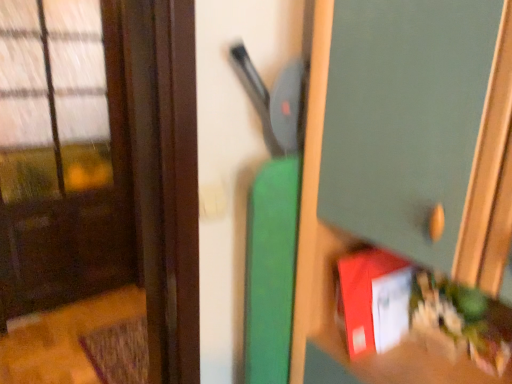
Locate an element on the screen. The width and height of the screenshot is (512, 384). matte red book at lower right, the 2th book positioned from the right is located at coordinates (374, 300).

Describe the element at coordinates (405, 164) in the screenshot. I see `green matte cabinet at center` at that location.

In order to face red matte book at lower right, which is counted as the first book, starting from the right, should I rotate leftwards or rightwards?

Rotate your view right by about 24.492°.

What do you see at coordinates (98, 189) in the screenshot?
I see `brown matte door at left` at bounding box center [98, 189].

Find the location of a particular element. matte red book at lower right, the 1th book positioned from the left is located at coordinates (374, 300).

How different are the orientations of brown matte door at left and red matte book at lower right, which is counted as the first book, starting from the right, in degrees?

The facing directions of brown matte door at left and red matte book at lower right, which is counted as the first book, starting from the right, are 88 degrees apart.

Which object is positioned more to the right, brown matte door at left or red matte book at lower right, which is counted as the first book, starting from the right?

From the viewer's perspective, red matte book at lower right, which is counted as the first book, starting from the right, appears more on the right side.

Considering the relative sizes of brown matte door at left and red matte book at lower right, which is counted as the 2th book, starting from the left, in the image provided, is brown matte door at left bigger than red matte book at lower right, which is counted as the 2th book, starting from the left,?

Correct, brown matte door at left is larger in size than red matte book at lower right, which is counted as the 2th book, starting from the left.

Which object is closer to the camera taking this photo, brown matte door at left or red matte book at lower right, which is counted as the 2th book, starting from the left?

red matte book at lower right, which is counted as the 2th book, starting from the left, is in front.

Does brown matte door at left have a greater width compared to green matte cabinet at center?

No, brown matte door at left is not wider than green matte cabinet at center.

From the image's perspective, is brown matte door at left over green matte cabinet at center?

Yes, from the image's perspective, brown matte door at left is on top of green matte cabinet at center.

In terms of height, does brown matte door at left look taller or shorter compared to green matte cabinet at center?

Clearly, brown matte door at left is taller compared to green matte cabinet at center.

Is brown matte door at left behind green matte cabinet at center?

Yes, brown matte door at left is behind green matte cabinet at center.

Measure the distance from red matte book at lower right, which is counted as the first book, starting from the right, to green matte cabinet at center.

red matte book at lower right, which is counted as the first book, starting from the right, and green matte cabinet at center are 7.42 inches apart from each other.

Is point (510, 380) positioned in front of point (434, 21)?

No.

Does red matte book at lower right, which is counted as the first book, starting from the right, come in front of green matte cabinet at center?

No, red matte book at lower right, which is counted as the first book, starting from the right, is behind green matte cabinet at center.

Is matte red book at lower right, the 2th book positioned from the right, located outside red matte book at lower right, which is counted as the first book, starting from the right?

matte red book at lower right, the 2th book positioned from the right, lies outside red matte book at lower right, which is counted as the first book, starting from the right,'s area.

Measure the distance between matte red book at lower right, the 1th book positioned from the left, and red matte book at lower right, which is counted as the first book, starting from the right.

matte red book at lower right, the 1th book positioned from the left, is 1.62 inches away from red matte book at lower right, which is counted as the first book, starting from the right.

From a real-world perspective, is matte red book at lower right, the 1th book positioned from the left, positioned under red matte book at lower right, which is counted as the 2th book, starting from the left, based on gravity?

No, from a real-world perspective, matte red book at lower right, the 1th book positioned from the left, is not below red matte book at lower right, which is counted as the 2th book, starting from the left.

Which object is closer to the camera taking this photo, matte red book at lower right, the 2th book positioned from the right, or red matte book at lower right, which is counted as the first book, starting from the right?

red matte book at lower right, which is counted as the first book, starting from the right, is closer to the camera.

Considering their positions, is matte red book at lower right, the 1th book positioned from the left, located in front of or behind green matte cabinet at center?

matte red book at lower right, the 1th book positioned from the left, is positioned farther from the viewer than green matte cabinet at center.

In the image, is matte red book at lower right, the 1th book positioned from the left, on the left side or the right side of green matte cabinet at center?

matte red book at lower right, the 1th book positioned from the left, is positioned on green matte cabinet at center's left side.

From the image's perspective, is matte red book at lower right, the 2th book positioned from the right, below green matte cabinet at center?

Yes, from the image's perspective, matte red book at lower right, the 2th book positioned from the right, is beneath green matte cabinet at center.

What's the angular difference between brown matte door at left and matte red book at lower right, the 1th book positioned from the left,'s facing directions?

6.19 degrees.

Can you see brown matte door at left touching matte red book at lower right, the 1th book positioned from the left?

brown matte door at left and matte red book at lower right, the 1th book positioned from the left, are not in contact.

From the image's perspective, is brown matte door at left on matte red book at lower right, the 2th book positioned from the right?

Yes.

From a real-world perspective, is brown matte door at left positioned above or below matte red book at lower right, the 2th book positioned from the right?

brown matte door at left is situated lower than matte red book at lower right, the 2th book positioned from the right, in the real world.

Is red matte book at lower right, which is counted as the 2th book, starting from the left, taller or shorter than matte red book at lower right, the 1th book positioned from the left?

red matte book at lower right, which is counted as the 2th book, starting from the left, is shorter than matte red book at lower right, the 1th book positioned from the left.

Between red matte book at lower right, which is counted as the first book, starting from the right, and matte red book at lower right, the 1th book positioned from the left, which one has smaller size?

Smaller between the two is red matte book at lower right, which is counted as the first book, starting from the right.

In terms of width, does red matte book at lower right, which is counted as the first book, starting from the right, look wider or thinner when compared to matte red book at lower right, the 2th book positioned from the right?

Clearly, red matte book at lower right, which is counted as the first book, starting from the right, has more width compared to matte red book at lower right, the 2th book positioned from the right.

Locate an element on the screen. The height and width of the screenshot is (384, 512). door below the red matte book at lower right, which is counted as the 2th book, starting from the left (from a real-world perspective) is located at coordinates (98, 189).

Image resolution: width=512 pixels, height=384 pixels. I want to click on dresser that appears above the brown matte door at left (from a real-world perspective), so click(x=405, y=164).

From the image, which object appears to be farther from brown matte door at left, matte red book at lower right, the 2th book positioned from the right, or green matte cabinet at center?

green matte cabinet at center is positioned further to the anchor brown matte door at left.

Which object lies further to the anchor point red matte book at lower right, which is counted as the first book, starting from the right, matte red book at lower right, the 1th book positioned from the left, or green matte cabinet at center?

Among the two, green matte cabinet at center is located further to red matte book at lower right, which is counted as the first book, starting from the right.

Which object lies further to the anchor point green matte cabinet at center, matte red book at lower right, the 2th book positioned from the right, or brown matte door at left?

brown matte door at left is positioned further to the anchor green matte cabinet at center.

Estimate the real-world distances between objects in this image. Which object is closer to red matte book at lower right, which is counted as the 2th book, starting from the left, green matte cabinet at center or brown matte door at left?

green matte cabinet at center.

Considering their positions, is red matte book at lower right, which is counted as the 2th book, starting from the left, positioned further to green matte cabinet at center than brown matte door at left?

The object further to green matte cabinet at center is brown matte door at left.

Based on their spatial positions, is red matte book at lower right, which is counted as the 2th book, starting from the left, or matte red book at lower right, the 2th book positioned from the right, further from green matte cabinet at center?

Based on the image, matte red book at lower right, the 2th book positioned from the right, appears to be further to green matte cabinet at center.

Considering their positions, is matte red book at lower right, the 1th book positioned from the left, positioned further to green matte cabinet at center than red matte book at lower right, which is counted as the first book, starting from the right?

matte red book at lower right, the 1th book positioned from the left, is further to green matte cabinet at center.

When comparing their distances from green matte cabinet at center, does brown matte door at left or red matte book at lower right, which is counted as the 2th book, starting from the left, seem further?

brown matte door at left is positioned further to the anchor green matte cabinet at center.

Identify the location of book located between brown matte door at left and green matte cabinet at center in the left-right direction. The width and height of the screenshot is (512, 384). (374, 300).

The height and width of the screenshot is (384, 512). Identify the location of book located between brown matte door at left and red matte book at lower right, which is counted as the first book, starting from the right, in the left-right direction. (374, 300).

Where is `dresser between brown matte door at left and red matte book at lower right, which is counted as the 2th book, starting from the left, in the horizontal direction`? dresser between brown matte door at left and red matte book at lower right, which is counted as the 2th book, starting from the left, in the horizontal direction is located at coordinates point(405,164).

The height and width of the screenshot is (384, 512). In order to click on book between green matte cabinet at center and matte red book at lower right, the 2th book positioned from the right, along the z-axis in this screenshot , I will do `click(421, 315)`.